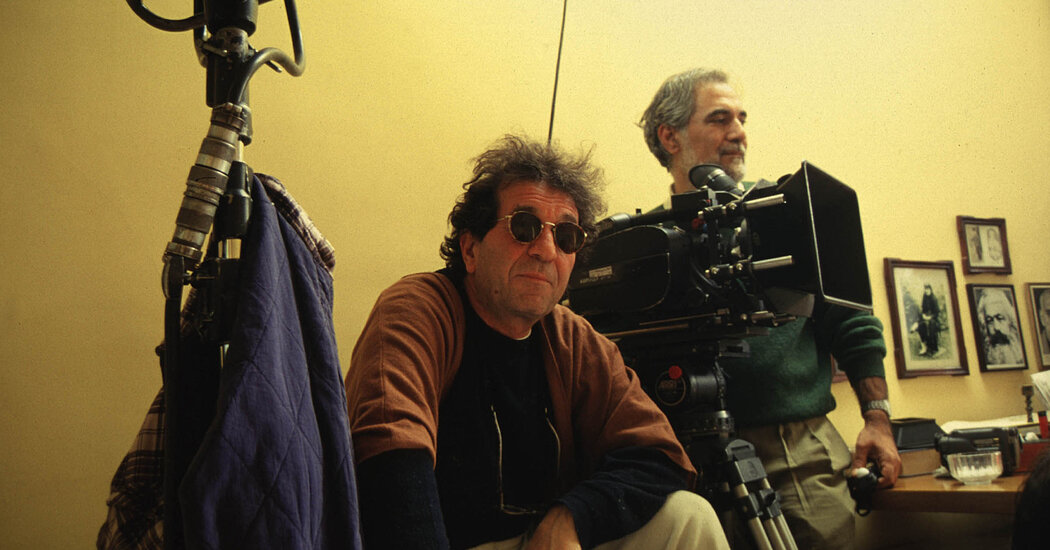
Locate an element on the screen. The width and height of the screenshot is (1050, 550). portrait of karl marx hangs on wall in 'office' is located at coordinates coord(1008,327).